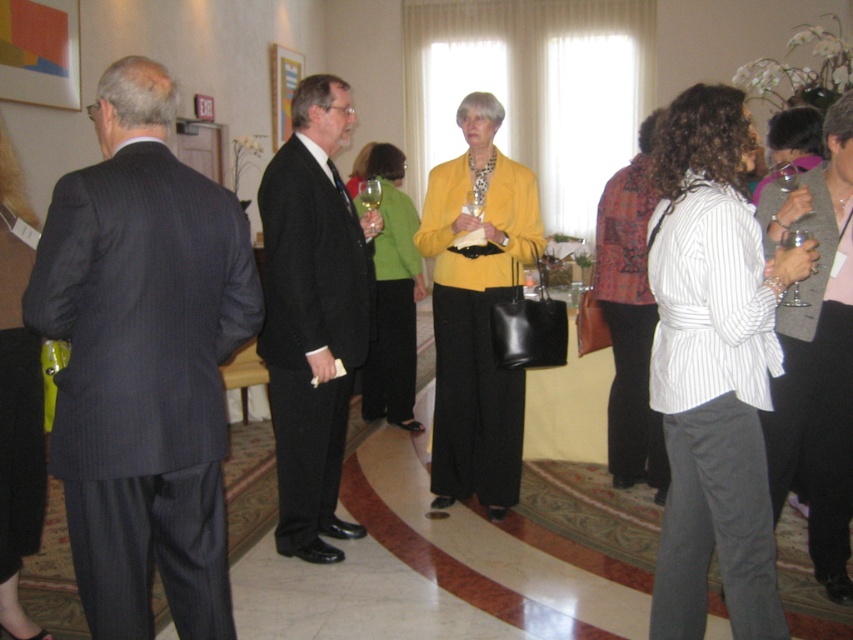
Question: Does matte yellow blazer at center have a smaller size compared to patchwork jacket at center?

Choices:
 (A) no
 (B) yes

Answer: (A)

Question: Estimate the real-world distances between objects in this image. Which object is closer to the black suit at center?

Choices:
 (A) clear glass wine glass at center right
 (B) matte yellow jacket at center
 (C) white striped shirt at center

Answer: (C)

Question: Can you confirm if matte yellow blazer at center is bigger than patchwork jacket at center?

Choices:
 (A) yes
 (B) no

Answer: (A)

Question: Does dark pinstripe suit at left have a larger size compared to white striped shirt at center?

Choices:
 (A) no
 (B) yes

Answer: (A)

Question: Which object appears closest to the camera in this image?

Choices:
 (A) striped cotton shirt at center
 (B) dark pinstripe suit at left

Answer: (B)

Question: Among these objects, which one is farthest from the camera?

Choices:
 (A) matte black dress at center
 (B) black suit at center
 (C) patchwork jacket at center
 (D) matte yellow jacket at center

Answer: (D)